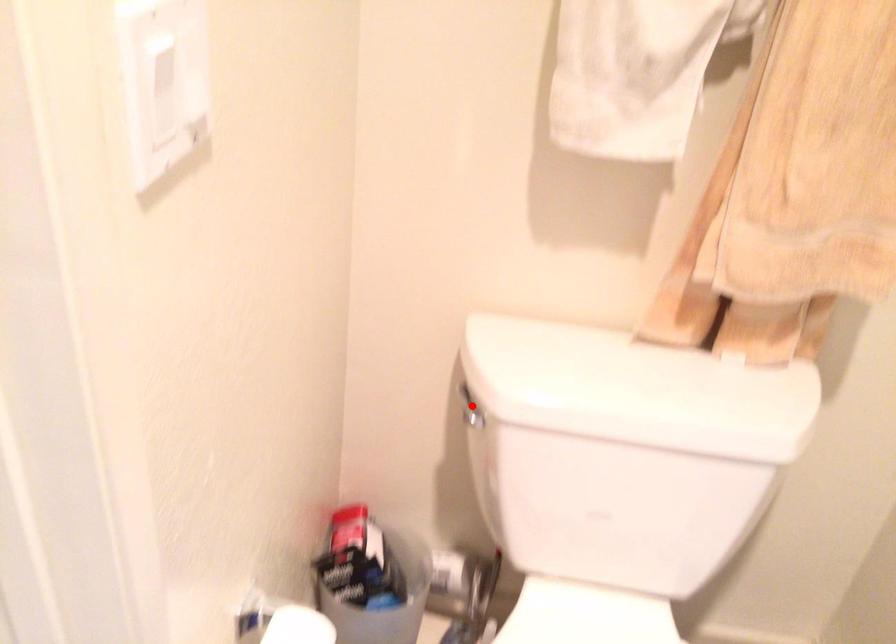
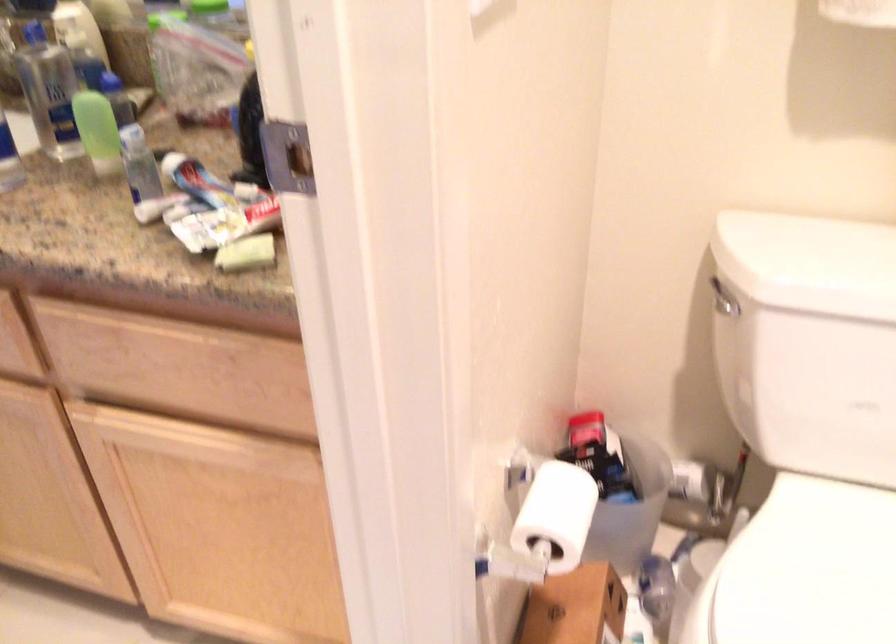
Locate, in the second image, the point that corresponds to the highlighted location in the first image.

(724, 299)